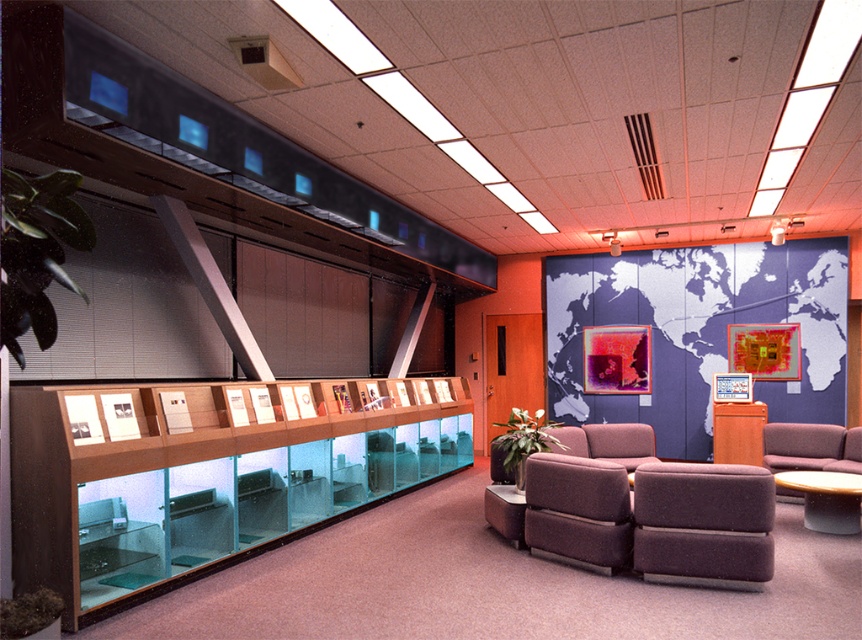
The height and width of the screenshot is (640, 862). What do you see at coordinates (207, 472) in the screenshot?
I see `clear glass display case at left` at bounding box center [207, 472].

Which of these two, clear glass display case at left or brown fabric swivel chair at lower right, stands shorter?

brown fabric swivel chair at lower right

At what (x,y) coordinates should I click in order to perform the action: click on clear glass display case at left. Please return your answer as a coordinate pair (x, y). The height and width of the screenshot is (640, 862). Looking at the image, I should click on [207, 472].

Is clear glass display case at left thinner than dark purple fabric couch at center?

No, clear glass display case at left is not thinner than dark purple fabric couch at center.

Which is in front, point (113, 560) or point (853, 467)?

Point (113, 560) is in front.

Image resolution: width=862 pixels, height=640 pixels. What are the coordinates of `clear glass display case at left` in the screenshot? It's located at (207, 472).

Find the location of a particular element. clear glass display case at left is located at coordinates (207, 472).

Can you confirm if brown fabric swivel chair at lower right is positioned below dark purple fabric couch at center?

Incorrect, brown fabric swivel chair at lower right is not positioned below dark purple fabric couch at center.

Is brown fabric swivel chair at lower right to the right of dark purple fabric couch at center from the viewer's perspective?

In fact, brown fabric swivel chair at lower right is to the left of dark purple fabric couch at center.

At what (x,y) coordinates should I click in order to perform the action: click on brown fabric swivel chair at lower right. Please return your answer as a coordinate pair (x, y). This screenshot has height=640, width=862. Looking at the image, I should click on (703, 522).

Image resolution: width=862 pixels, height=640 pixels. Find the location of `brown fabric swivel chair at lower right`. brown fabric swivel chair at lower right is located at coordinates (703, 522).